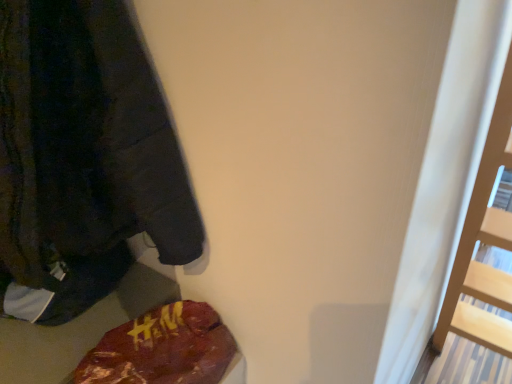
Question: Considering the positions of dark gray fleece sweatshirt at left and maroon fabric bag at lower left in the image, is dark gray fleece sweatshirt at left taller or shorter than maroon fabric bag at lower left?

Choices:
 (A) tall
 (B) short

Answer: (A)

Question: Visually, is dark gray fleece sweatshirt at left positioned to the left or to the right of maroon fabric bag at lower left?

Choices:
 (A) left
 (B) right

Answer: (A)

Question: Considering the positions of dark gray fleece sweatshirt at left and maroon fabric bag at lower left in the image, is dark gray fleece sweatshirt at left wider or thinner than maroon fabric bag at lower left?

Choices:
 (A) thin
 (B) wide

Answer: (B)

Question: Is maroon fabric bag at lower left taller or shorter than dark gray fleece sweatshirt at left?

Choices:
 (A) tall
 (B) short

Answer: (B)

Question: Is maroon fabric bag at lower left inside or outside of dark gray fleece sweatshirt at left?

Choices:
 (A) outside
 (B) inside

Answer: (A)

Question: Is maroon fabric bag at lower left to the left or to the right of dark gray fleece sweatshirt at left in the image?

Choices:
 (A) right
 (B) left

Answer: (A)

Question: From a real-world perspective, is maroon fabric bag at lower left physically located above or below dark gray fleece sweatshirt at left?

Choices:
 (A) below
 (B) above

Answer: (A)